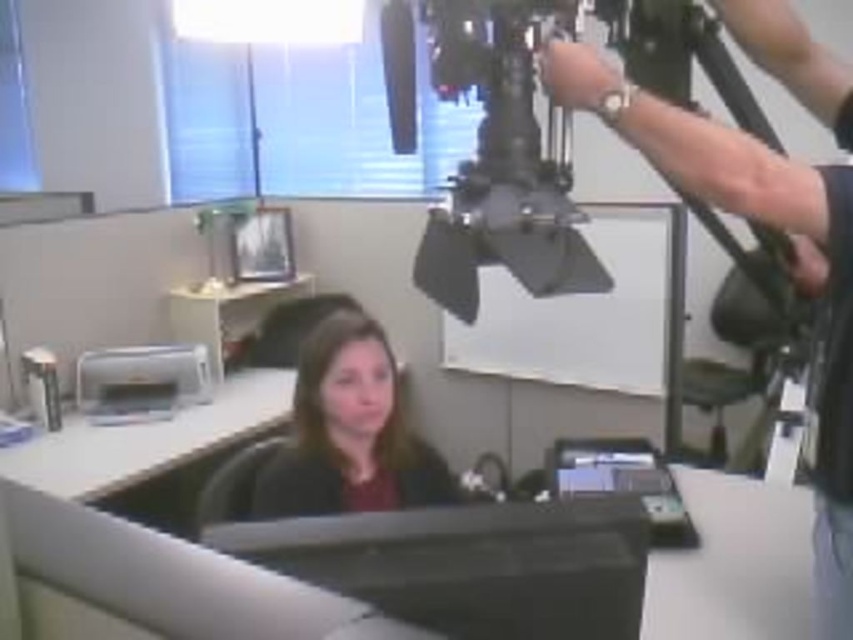
Question: Which point is farther to the camera?

Choices:
 (A) 723,166
 (B) 450,604

Answer: (A)

Question: Is black glossy monitor at center bigger than matte black shirt at center?

Choices:
 (A) no
 (B) yes

Answer: (A)

Question: Is metallic silver tripod at upper right positioned behind black glossy monitor at center?

Choices:
 (A) no
 (B) yes

Answer: (B)

Question: Which object is positioned closest to the metallic silver tripod at upper right?

Choices:
 (A) matte black shirt at center
 (B) black glossy monitor at center

Answer: (B)

Question: Which of the following is the closest to the observer?

Choices:
 (A) (260, 529)
 (B) (814, 202)

Answer: (A)

Question: In this image, where is metallic silver tripod at upper right located relative to matte black shirt at center?

Choices:
 (A) below
 (B) above

Answer: (B)